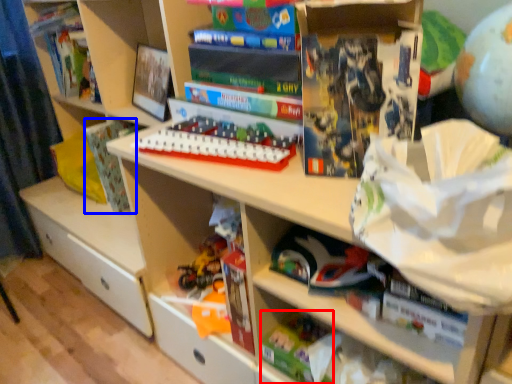
Question: Which point is closer to the camera, toy (highlighted by a red box) or paperback book (highlighted by a blue box)?

Choices:
 (A) toy
 (B) paperback book

Answer: (A)